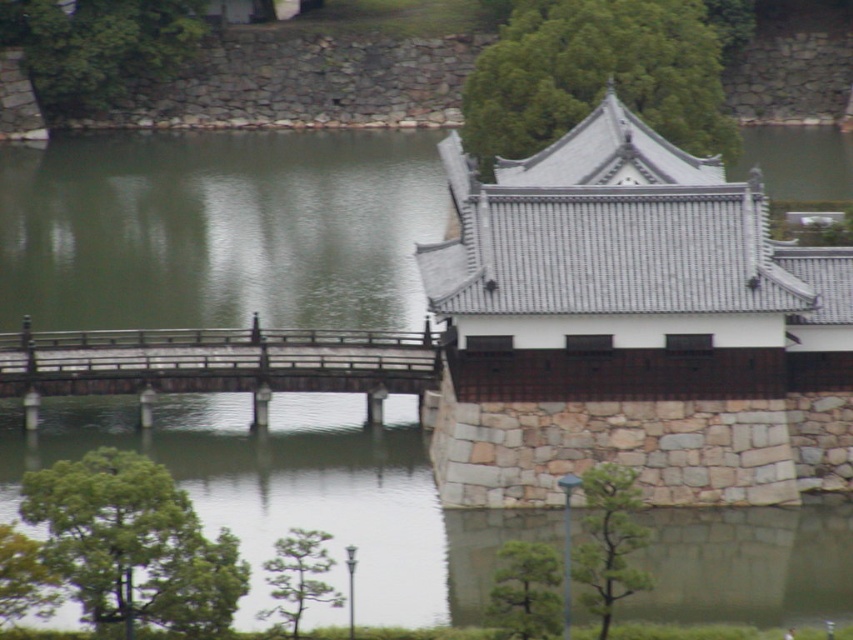
You are a visitor standing on the wooden bridge at center and want to reach the stone tiled roof at upper right. The path between them is 19.33 feet. If you walk at a speed of 3 feet per second, how many seconds will it take to reach the stone tiled roof?

The distance between the wooden bridge at center and the stone tiled roof at upper right is 19.33 feet. At a walking speed of 3 feet per second, it would take approximately 6.44 seconds to reach the stone tiled roof at upper right.

You are a visitor standing on the wooden bridge at center and looking towards the stone tiled roof at upper right. Which object is higher in elevation?

The stone tiled roof at upper right is higher in elevation than the wooden bridge at center because it is located above it.